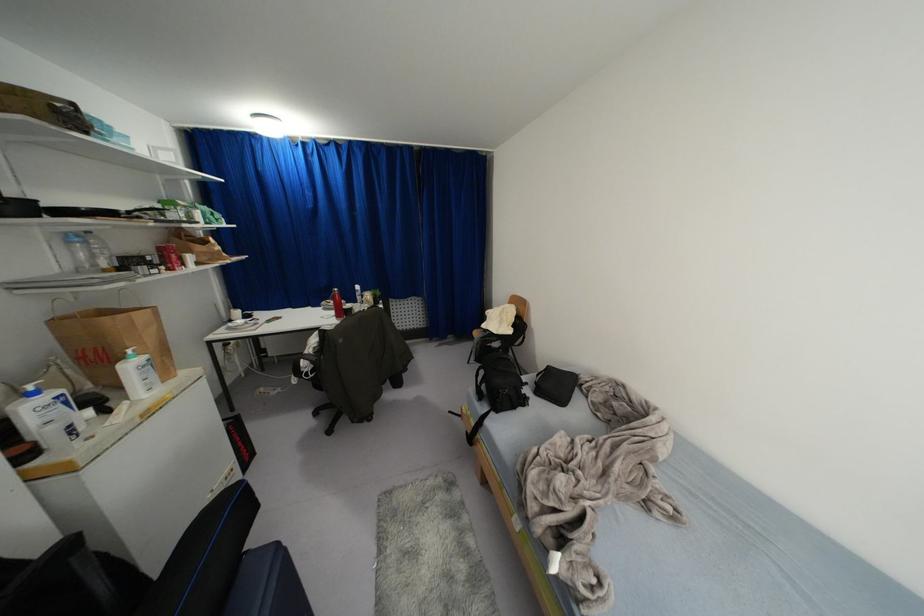
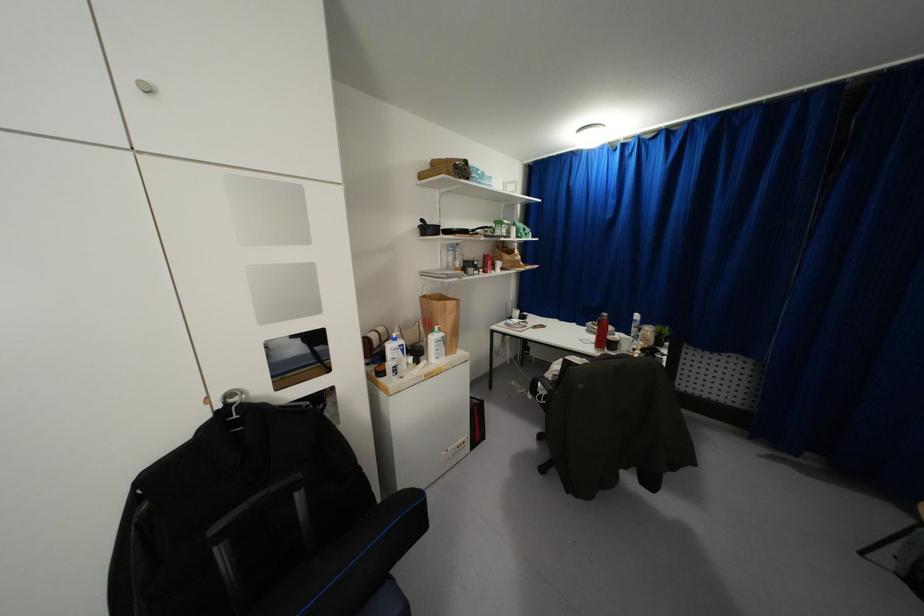
Find the pixel in the second image that matches [103,318] in the first image.

(434, 302)